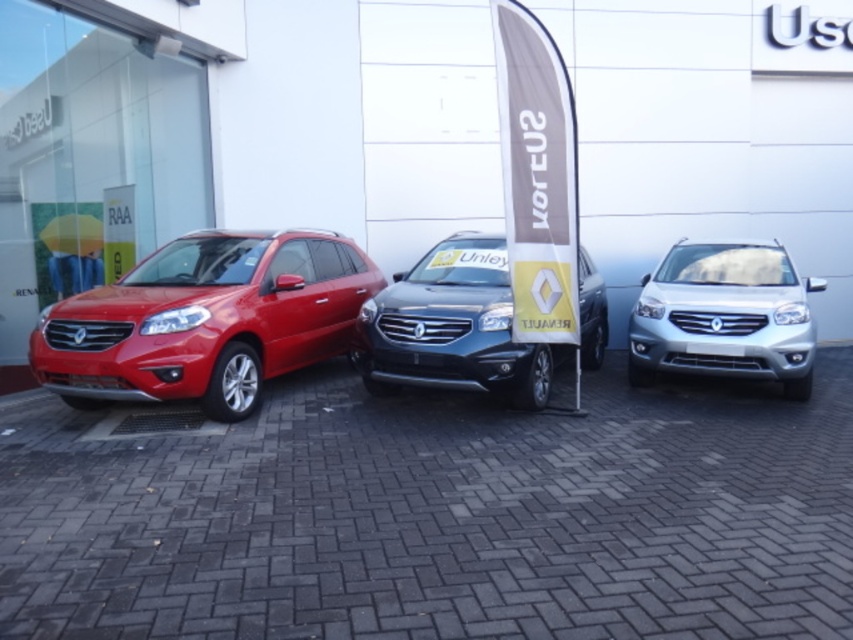
Which is above, matte red suv at left or silver metallic suv at center?

Positioned higher is matte red suv at left.

Who is more forward, [77,356] or [730,330]?

Point [77,356]

At what (x,y) coordinates should I click in order to perform the action: click on matte red suv at left. Please return your answer as a coordinate pair (x, y). Looking at the image, I should click on (206, 320).

From the picture: Can you confirm if matte red suv at left is bigger than satin metallic suv at center?

Yes.

Who is lower down, matte red suv at left or satin metallic suv at center?

satin metallic suv at center is below.

Is point (325, 330) closer to viewer compared to point (482, 365)?

No, (325, 330) is further to viewer.

This screenshot has height=640, width=853. I want to click on matte red suv at left, so click(206, 320).

How much distance is there between satin metallic suv at center and silver metallic suv at center?

The distance of satin metallic suv at center from silver metallic suv at center is 1.71 meters.

Image resolution: width=853 pixels, height=640 pixels. Find the location of `satin metallic suv at center`. satin metallic suv at center is located at coordinates (453, 326).

Is point (531, 396) positioned after point (788, 324)?

No, (531, 396) is closer to viewer.

Find the location of a particular element. satin metallic suv at center is located at coordinates (453, 326).